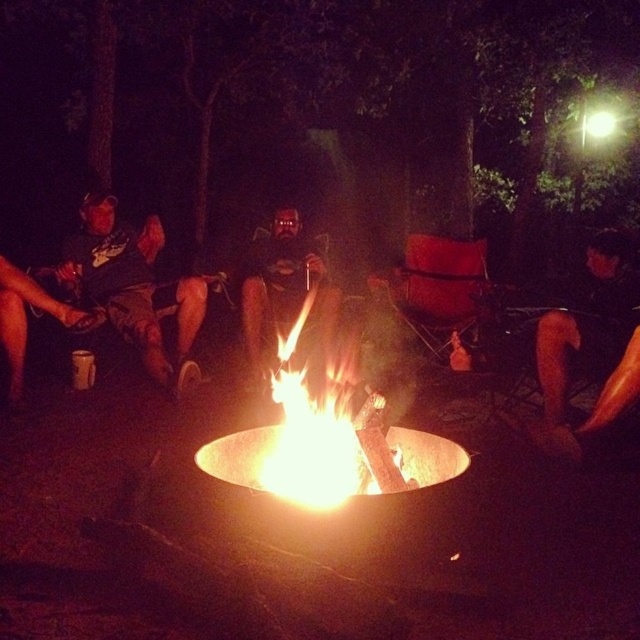
Question: Estimate the real-world distances between objects in this image. Which object is farther from the orange fabric pants at right?

Choices:
 (A) brushed metal mug at left
 (B) matte black shirt at center
 (C) flaming wood at center

Answer: (A)

Question: Can you confirm if brushed metal mug at left is positioned above matte black shirt at center?

Choices:
 (A) yes
 (B) no

Answer: (B)

Question: Which point appears farthest from the camera in this image?

Choices:
 (A) (435, 294)
 (B) (90, 243)
 (C) (20, 289)

Answer: (A)

Question: Can you confirm if matte red chair at center is positioned to the right of matte black mug at left?

Choices:
 (A) yes
 (B) no

Answer: (A)

Question: Which point appears farthest from the camera in this image?

Choices:
 (A) (275, 211)
 (B) (593, 241)
 (C) (342, 452)

Answer: (A)

Question: Can you confirm if flaming wood at center is positioned above matte black shirt at center?

Choices:
 (A) yes
 (B) no

Answer: (B)